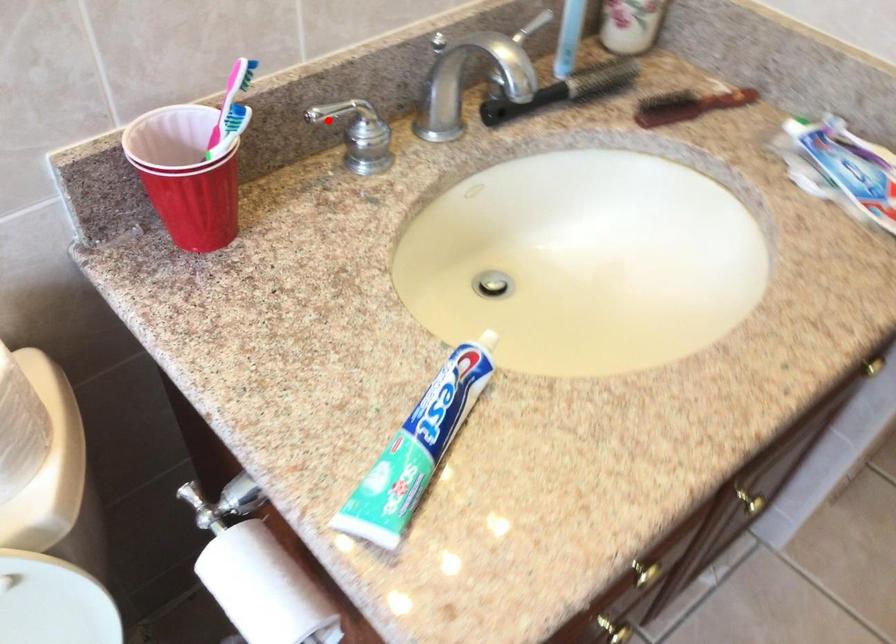
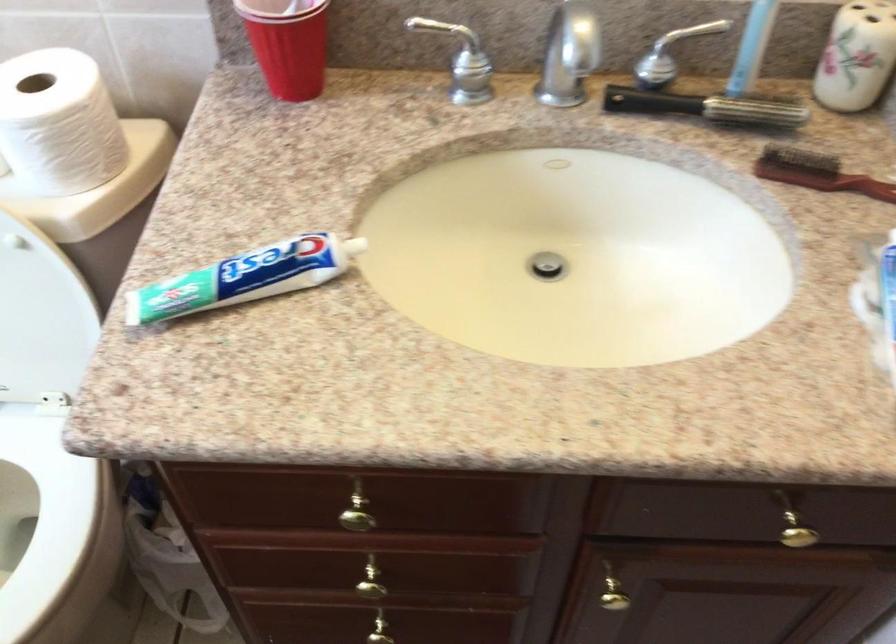
Where in the second image is the point corresponding to the highlighted location from the first image?

(455, 44)